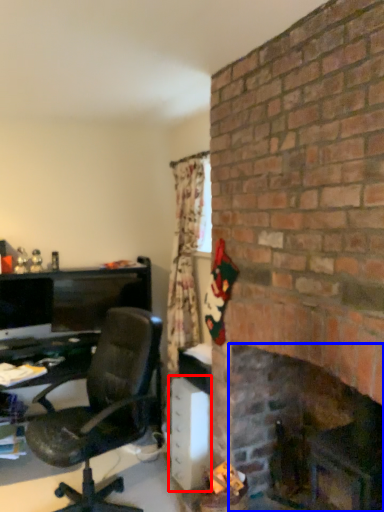
Question: Which of the following is the closest to the observer, file cabinet (highlighted by a red box) or fireplace (highlighted by a blue box)?

Choices:
 (A) file cabinet
 (B) fireplace

Answer: (B)